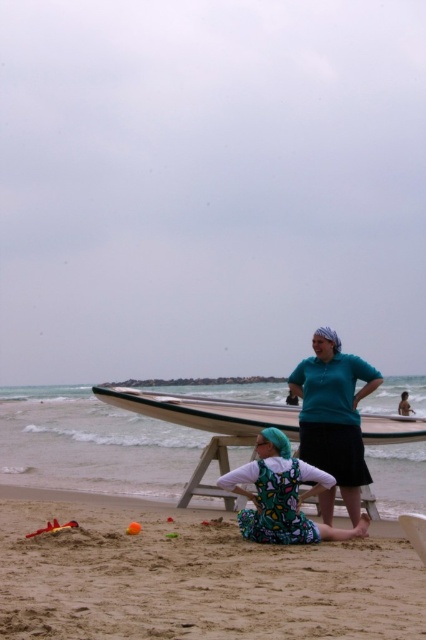
You are planning to set up a picnic lunch for two people. You have a wooden picnic table at center and a white foam surfboard at center. Which object should you place the food on to ensure it stays dry and away from the surfboard?

The wooden picnic table at center is to the left of white foam surfboard at center, so you should place the food on the wooden picnic table at center to keep it dry and away from the surfboard.

You are planning to set up a small tent between the wooden picnic table at center and the white foam surfboard at center. The tent requires 6 meters of space. Can you fit the tent between them?

The wooden picnic table at center and white foam surfboard at center are 5.60 meters apart from each other. Since the tent requires 6 meters of space, it cannot be fitted between them as the available space is insufficient.

You are standing on the beach and see the printed fabric swimsuit at center and the white foam surfboard at center. Which one is closer to the left side of the beach?

The printed fabric swimsuit at center is to the left of the white foam surfboard at center, so it is closer to the left side of the beach.